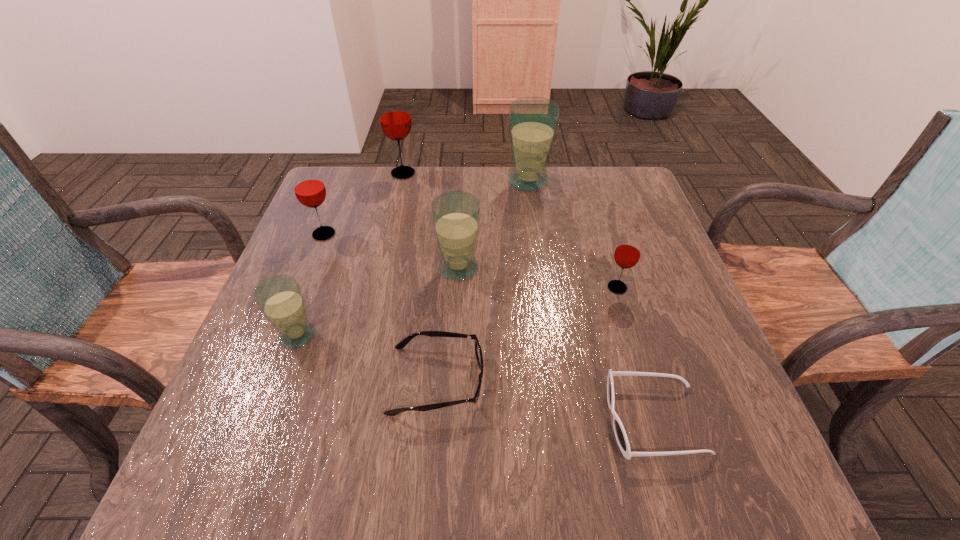
Locate an element on the screen. The width and height of the screenshot is (960, 540). vacant area that lies between the smallest red glass and the black sunglasses is located at coordinates (636, 354).

Locate an element on the screen. free spot between the third object from left to right and the third object from right to left is located at coordinates coord(466,178).

You are a GUI agent. You are given a task and a screenshot of the screen. Output one action in this format:
    pyautogui.click(x=<x>, y=<y>)
    Task: Click on the free space between the sunglasses and the smallest red glass
    
    Given the screenshot: What is the action you would take?
    pyautogui.click(x=636, y=354)

The width and height of the screenshot is (960, 540). What are the coordinates of `empty space that is in between the black sunglasses and the spectacles` in the screenshot? It's located at (545, 400).

Locate an element on the screen. object that stands as the closest to the nearest red glass is located at coordinates (620, 434).

Identify which object is the third closest to the second smallest red glass. Please provide its 2D coordinates. Your answer should be formatted as a tuple, i.e. [(x, y)], where the tuple contains the x and y coordinates of a point satisfying the conditions above.

[(455, 215)]

Identify the location of the fourth closest glass to the fourth glass from left to right. (627, 253).

You are a GUI agent. You are given a task and a screenshot of the screen. Output one action in this format:
    pyautogui.click(x=<x>, y=<y>)
    Task: Click on the glass object that ranks as the closest to the second blue glass from right to left
    This screenshot has width=960, height=540.
    Given the screenshot: What is the action you would take?
    point(280,298)

Locate which red glass is the second closest to the third glass from right to left. Please provide its 2D coordinates. Your answer should be formatted as a tuple, i.e. [(x, y)], where the tuple contains the x and y coordinates of a point satisfying the conditions above.

[(627, 253)]

Identify which red glass is located as the nearest to the leftmost red glass. Please provide its 2D coordinates. Your answer should be formatted as a tuple, i.e. [(x, y)], where the tuple contains the x and y coordinates of a point satisfying the conditions above.

[(395, 119)]